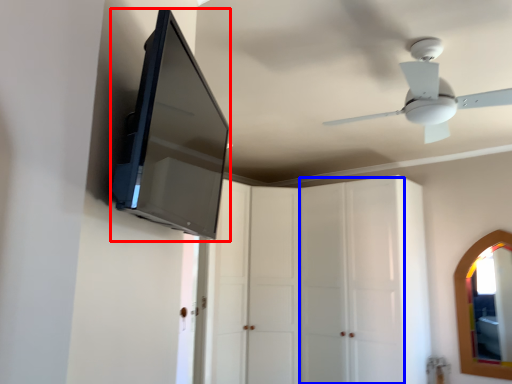
Question: Which object appears farthest to the camera in this image, medicine cabinet (highlighted by a red box) or glass door (highlighted by a blue box)?

Choices:
 (A) medicine cabinet
 (B) glass door

Answer: (B)